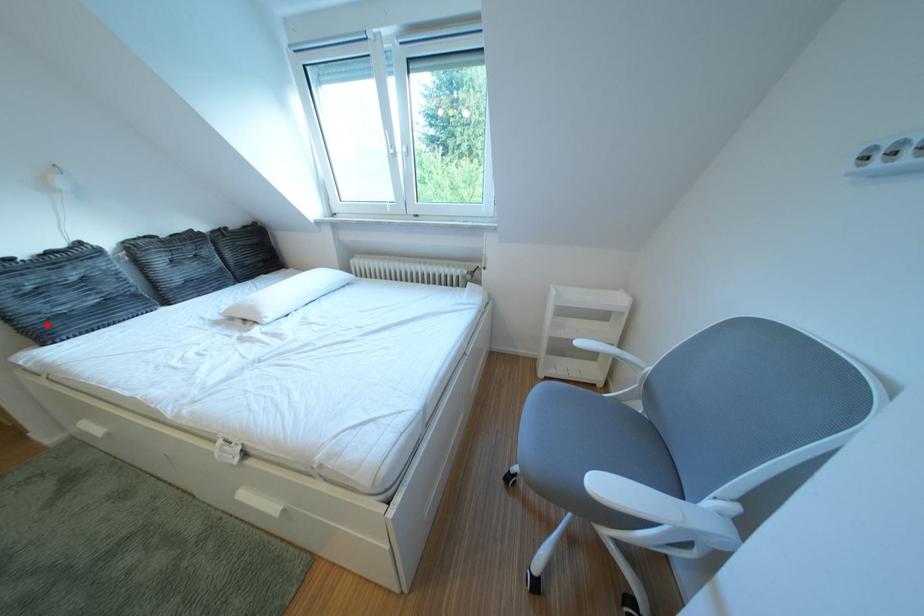
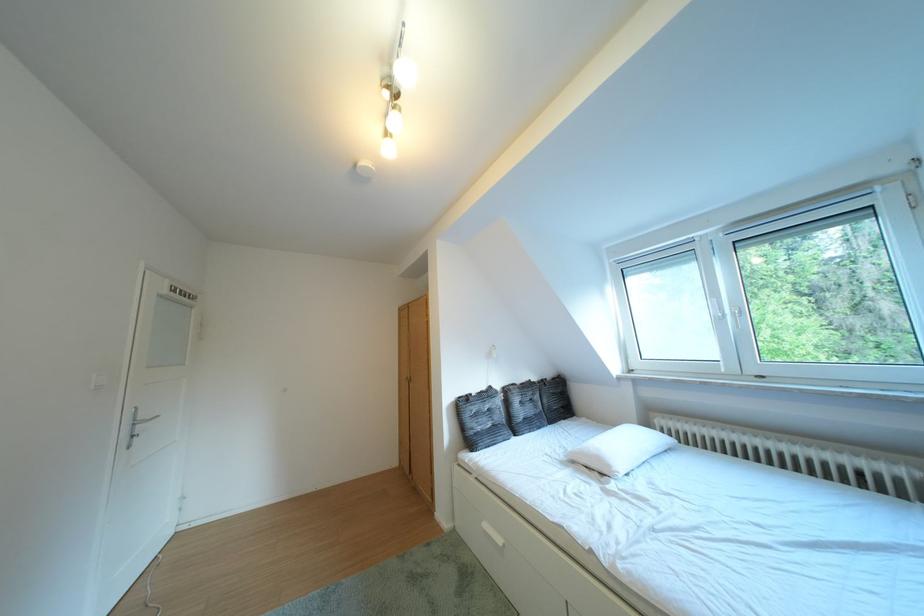
Question: I am providing you with two images of the same scene from different viewpoints. A red point is shown in image1. For the corresponding object point in image2, is it positioned nearer or farther from the camera?

Choices:
 (A) Nearer
 (B) Farther

Answer: (B)